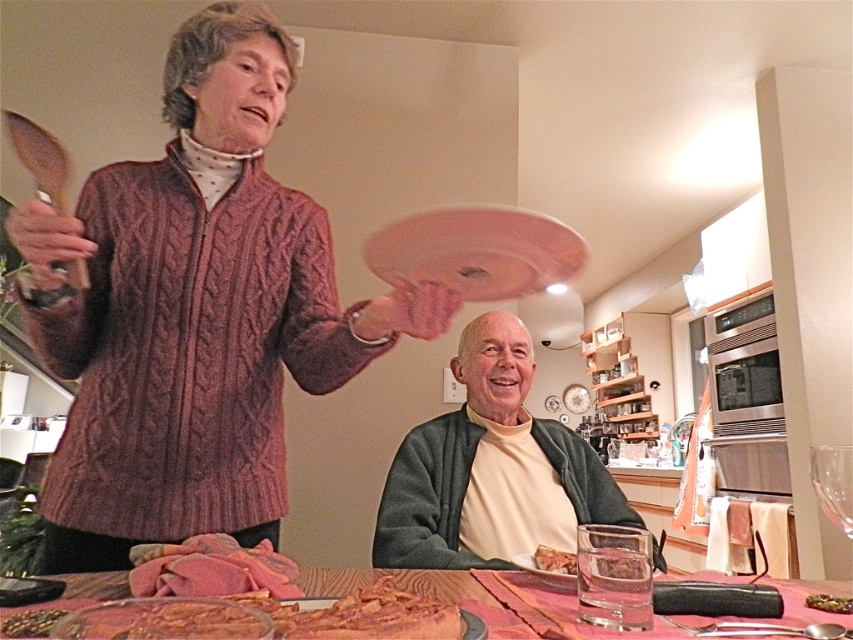
What is located at the coordinates point (32, 621)?

The shiny golden seeds at lower left are located at point (32, 621).

From the picture: You are standing in the kitchen and see the matte green sweater at center. Can you estimate its position relative to the dining table?

The matte green sweater at center is located at point 0.734 on the x and 0.577 on the y axis. Since the dining table is in the foreground, the sweater is positioned slightly to the right and above it.